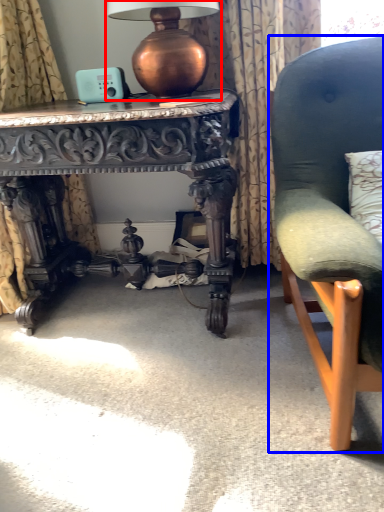
Question: Among these objects, which one is nearest to the camera, table lamp (highlighted by a red box) or chair (highlighted by a blue box)?

Choices:
 (A) table lamp
 (B) chair

Answer: (B)